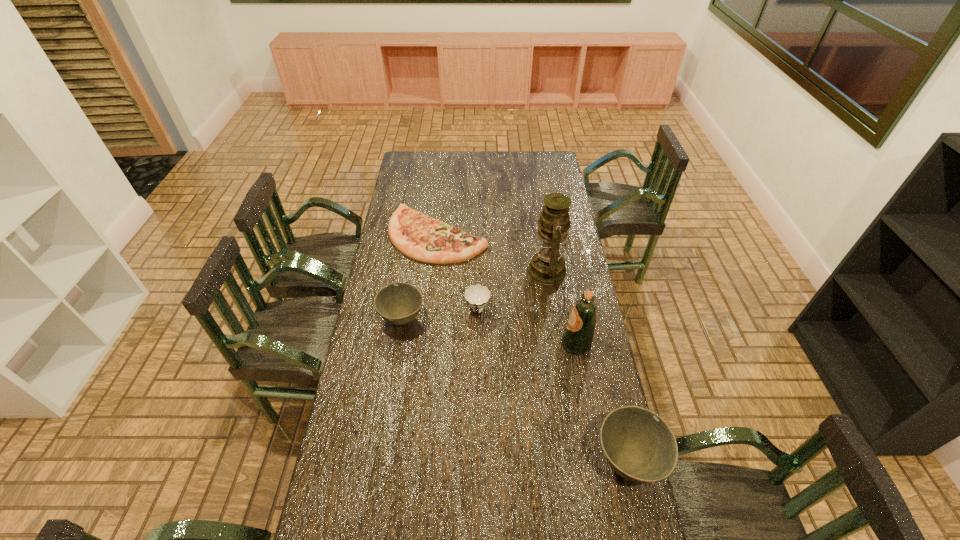
If the aim is uniform spacing by inserting an additional bowl among them, please point to a vacant space for this new bowl. Please provide its 2D coordinates. Your answer should be formatted as a tuple, i.e. [(x, y)], where the tuple contains the x and y coordinates of a point satisfying the conditions above.

[(501, 381)]